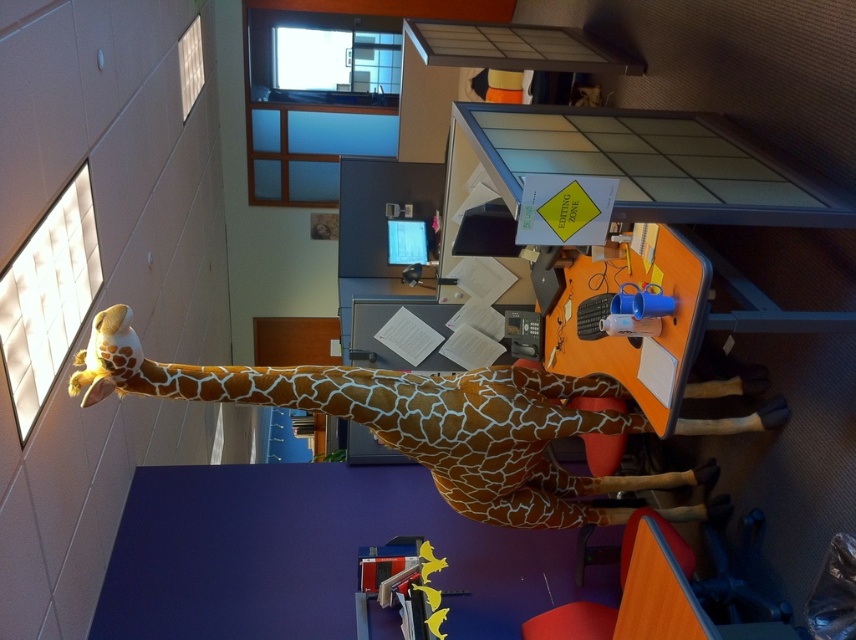
Does brown spotted plush giraffe at center appear over yellow plastic toy at lower center?

Yes, brown spotted plush giraffe at center is above yellow plastic toy at lower center.

Is brown spotted plush giraffe at center shorter than yellow plastic toy at lower center?

In fact, brown spotted plush giraffe at center may be taller than yellow plastic toy at lower center.

What do you see at coordinates (414, 420) in the screenshot? I see `brown spotted plush giraffe at center` at bounding box center [414, 420].

The height and width of the screenshot is (640, 856). Find the location of `brown spotted plush giraffe at center`. brown spotted plush giraffe at center is located at coordinates (414, 420).